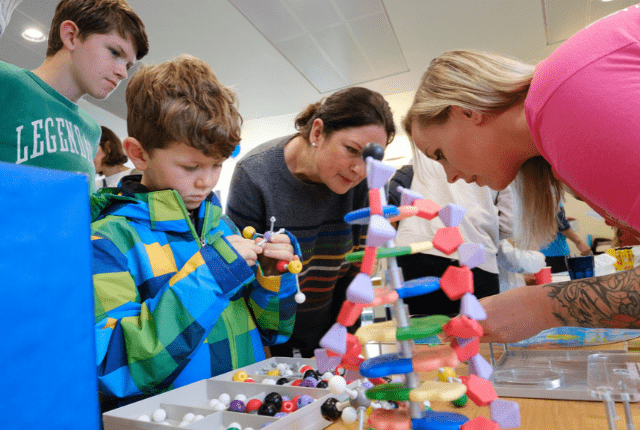
At what (x,y) coordinates should I click in order to perform the action: click on white ceiling. Please return your answer as a coordinate pair (x, y). Looking at the image, I should click on (250, 49), (329, 49), (468, 44).